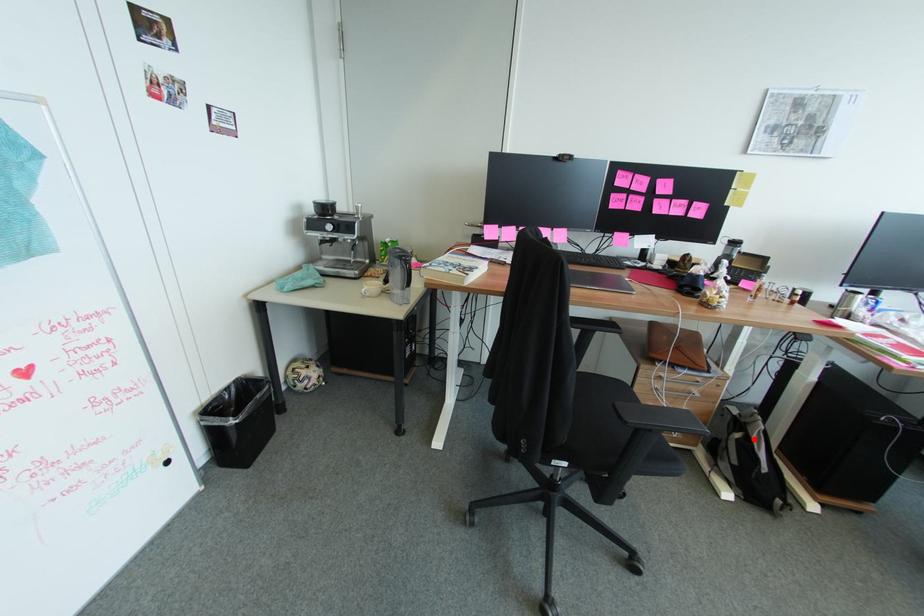
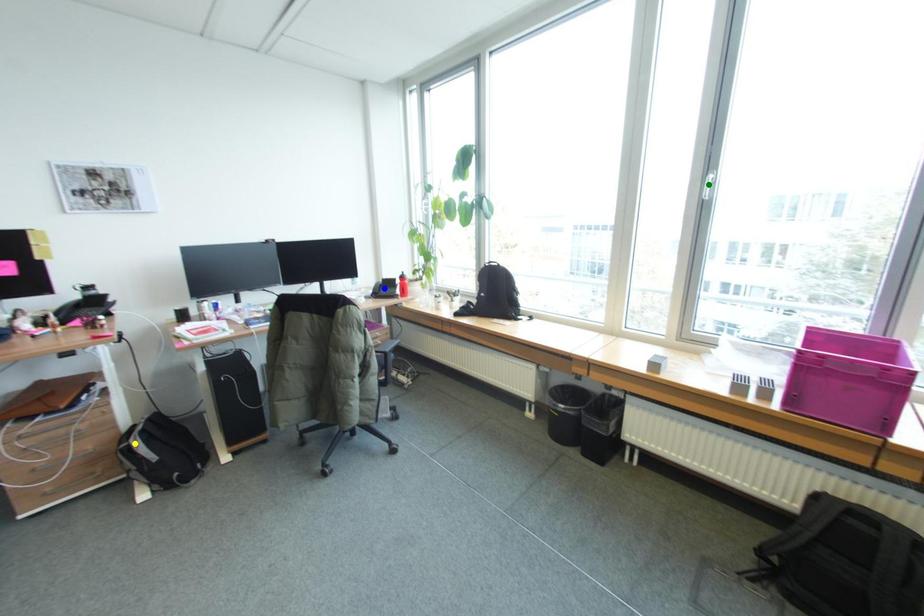
Question: I am providing you with two images of the same scene from different viewpoints. A red point is marked on the first image. You are given multiple points on the second image. Can you choose the point in image 2 that corresponds to the point in image 1?

Choices:
 (A) blue point
 (B) green point
 (C) yellow point

Answer: (C)